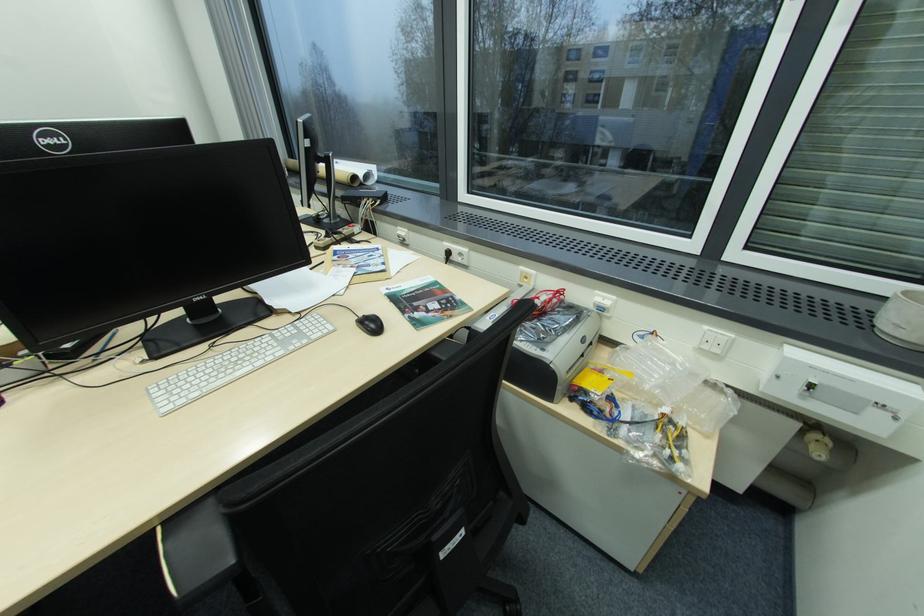
Find where to lift the white ceramic pot. Please return your answer as a coordinate pair (x, y).

(902, 318)